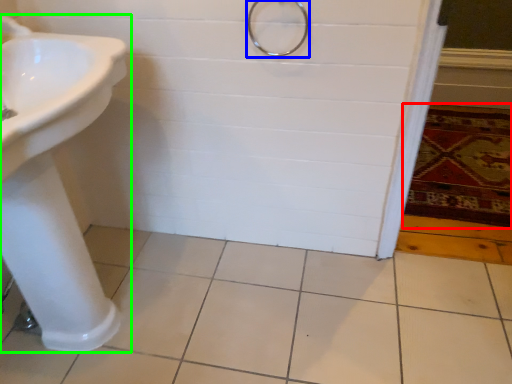
Question: Based on their relative distances, which object is nearer to bath mat (highlighted by a red box)? Choose from shower (highlighted by a blue box) and sink (highlighted by a green box).

Choices:
 (A) shower
 (B) sink

Answer: (A)